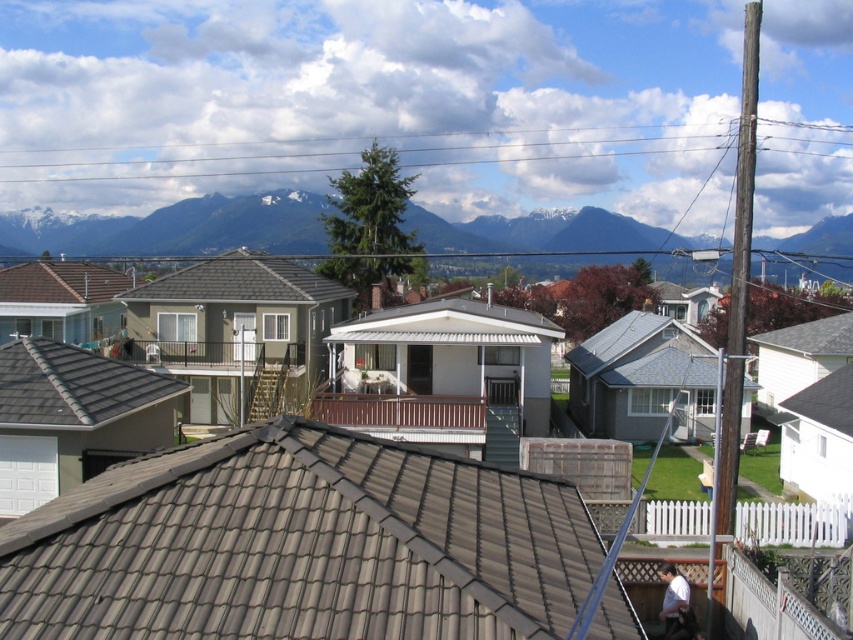
Question: Estimate the real-world distances between objects in this image. Which object is farther from the brown tile roof at upper center?

Choices:
 (A) brown tile roof at upper left
 (B) gray tile roof at lower left
 (C) gray tile roof at center
 (D) white tile roof at center

Answer: (A)

Question: Can you confirm if gray tile roof at center is smaller than white tile roof at center?

Choices:
 (A) no
 (B) yes

Answer: (A)

Question: Can you confirm if gray tile roof at lower left is positioned above white tile roof at center?

Choices:
 (A) yes
 (B) no

Answer: (B)

Question: Which of the following is the closest to the observer?

Choices:
 (A) (148, 378)
 (B) (439, 304)
 (C) (70, 272)

Answer: (A)

Question: Does gray tile roof at lower left appear under gray tile roof at center?

Choices:
 (A) no
 (B) yes

Answer: (B)

Question: Which point is closer to the camera taking this photo?

Choices:
 (A) (360, 564)
 (B) (387, 321)

Answer: (A)